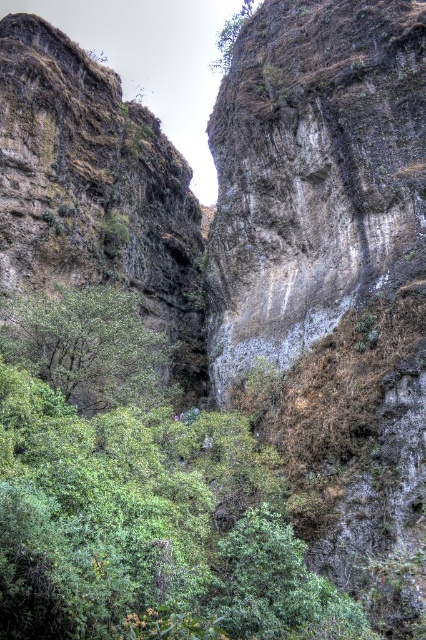
Is point (422, 250) farther from camera compared to point (222, 35)?

No.

Does rough stone rock face at center have a greater height compared to green leafy tree at upper center?

No.

Is point (367, 68) closer to camera compared to point (236, 35)?

Yes, it is.

In order to click on rough stone rock face at center in this screenshot , I will do `click(313, 173)`.

Consider the image. Between rough stone rock face at center and green leafy tree at center, which one is positioned higher?

Positioned higher is rough stone rock face at center.

Is rough stone rock face at center below green leafy tree at center?

Incorrect, rough stone rock face at center is not positioned below green leafy tree at center.

Does point (256, 257) come farther from viewer compared to point (129, 324)?

Yes, it is.

Find the location of a particular element. The height and width of the screenshot is (640, 426). rough stone rock face at center is located at coordinates tap(313, 173).

Can you confirm if rough stone rock face at center is thinner than rough textured rock at left?

Yes.

Is rough stone rock face at center below rough textured rock at left?

Incorrect, rough stone rock face at center is not positioned below rough textured rock at left.

In the scene shown: Measure the distance between rough stone rock face at center and camera.

rough stone rock face at center is 66.02 meters away from camera.

Where is `rough stone rock face at center`? This screenshot has width=426, height=640. rough stone rock face at center is located at coordinates (313, 173).